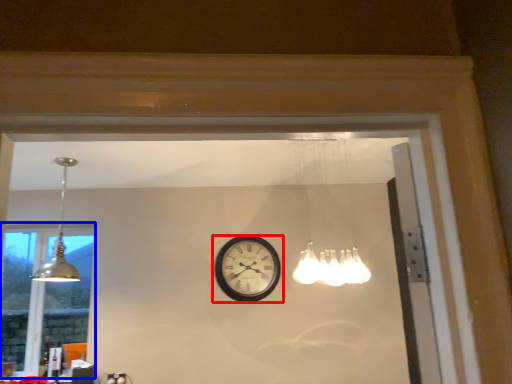
Question: Which object appears closest to the camera in this image, wall clock (highlighted by a red box) or window (highlighted by a blue box)?

Choices:
 (A) wall clock
 (B) window

Answer: (A)